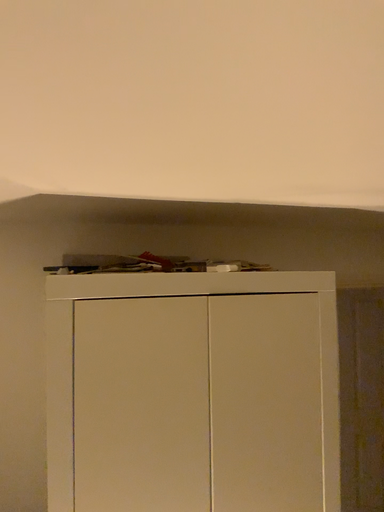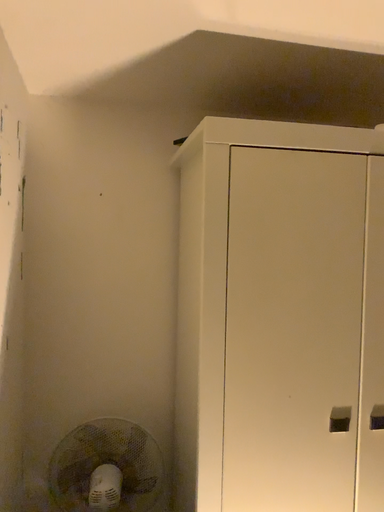
Question: Which way did the camera rotate in the video?

Choices:
 (A) rotated right
 (B) rotated left

Answer: (B)